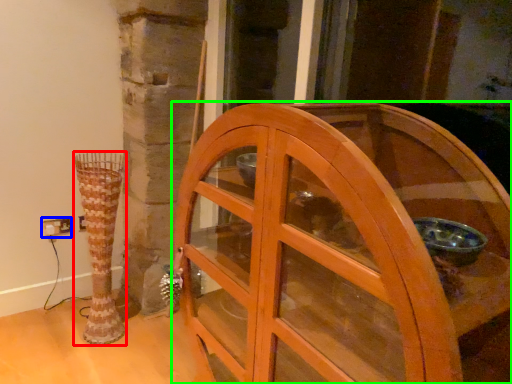
Question: Which is nearer to the vase (highlighted by a red box)? electric outlet (highlighted by a blue box) or furniture (highlighted by a green box).

Choices:
 (A) electric outlet
 (B) furniture

Answer: (A)